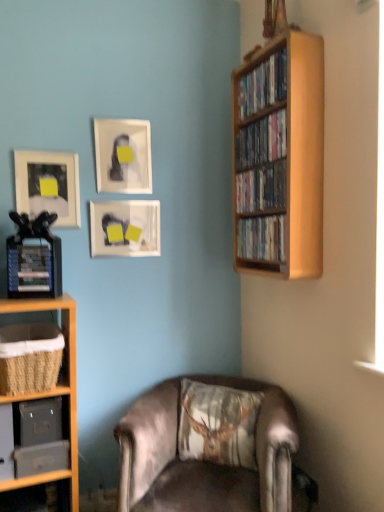
Question: Is there a large distance between wooden shelf at lower left, the first shelf when ordered from bottom to top, and wooden bookshelf at right?

Choices:
 (A) yes
 (B) no

Answer: (A)

Question: From the image's perspective, is wooden shelf at lower left, the first shelf when ordered from bottom to top, on top of wooden bookshelf at right?

Choices:
 (A) no
 (B) yes

Answer: (A)

Question: From a real-world perspective, is wooden shelf at lower left, the 2th shelf in the top-to-bottom sequence, physically below wooden bookshelf at right?

Choices:
 (A) no
 (B) yes

Answer: (B)

Question: Can you confirm if wooden shelf at lower left, the first shelf when ordered from bottom to top, is wider than wooden bookshelf at right?

Choices:
 (A) no
 (B) yes

Answer: (B)

Question: Considering the relative positions of wooden shelf at lower left, the 2th shelf in the top-to-bottom sequence, and wooden bookshelf at right in the image provided, is wooden shelf at lower left, the 2th shelf in the top-to-bottom sequence, in front of wooden bookshelf at right?

Choices:
 (A) no
 (B) yes

Answer: (B)

Question: Considering their positions, is hardcover book at left located in front of or behind matte glass picture frame at center, arranged as the 3th picture frame when viewed from the left?

Choices:
 (A) front
 (B) behind

Answer: (A)

Question: From the image's perspective, is hardcover book at left above or below matte glass picture frame at center, the first picture frame when ordered from right to left?

Choices:
 (A) above
 (B) below

Answer: (B)

Question: In the image, is hardcover book at left on the left side or the right side of matte glass picture frame at center, arranged as the 3th picture frame when viewed from the left?

Choices:
 (A) left
 (B) right

Answer: (A)

Question: Is hardcover book at left situated inside matte glass picture frame at center, arranged as the 3th picture frame when viewed from the left, or outside?

Choices:
 (A) inside
 (B) outside

Answer: (B)

Question: In the image, is woven brown basket at lower left, placed as the second shelf when sorted from bottom to top, positioned in front of or behind wooden shelf at upper right, which is the 3th book from bottom to top?

Choices:
 (A) behind
 (B) front

Answer: (B)

Question: From a real-world perspective, is woven brown basket at lower left, placed as the second shelf when sorted from bottom to top, above or below wooden shelf at upper right, which is the 3th book from bottom to top?

Choices:
 (A) below
 (B) above

Answer: (A)

Question: Based on their positions, is woven brown basket at lower left, placed as the second shelf when sorted from bottom to top, located to the left or right of wooden shelf at upper right, placed as the second book when sorted from top to bottom?

Choices:
 (A) right
 (B) left

Answer: (B)

Question: Is woven brown basket at lower left, which appears as the 1th shelf when viewed from the top, situated inside wooden shelf at upper right, which is the 3th book from bottom to top, or outside?

Choices:
 (A) inside
 (B) outside

Answer: (B)

Question: In terms of height, does wooden shelf at upper right, marked as the first book in a top-to-bottom arrangement, look taller or shorter compared to printed fabric cushion at lower center?

Choices:
 (A) short
 (B) tall

Answer: (A)

Question: Considering the positions of point (238, 96) and point (198, 450), is point (238, 96) closer or farther from the camera than point (198, 450)?

Choices:
 (A) farther
 (B) closer

Answer: (A)